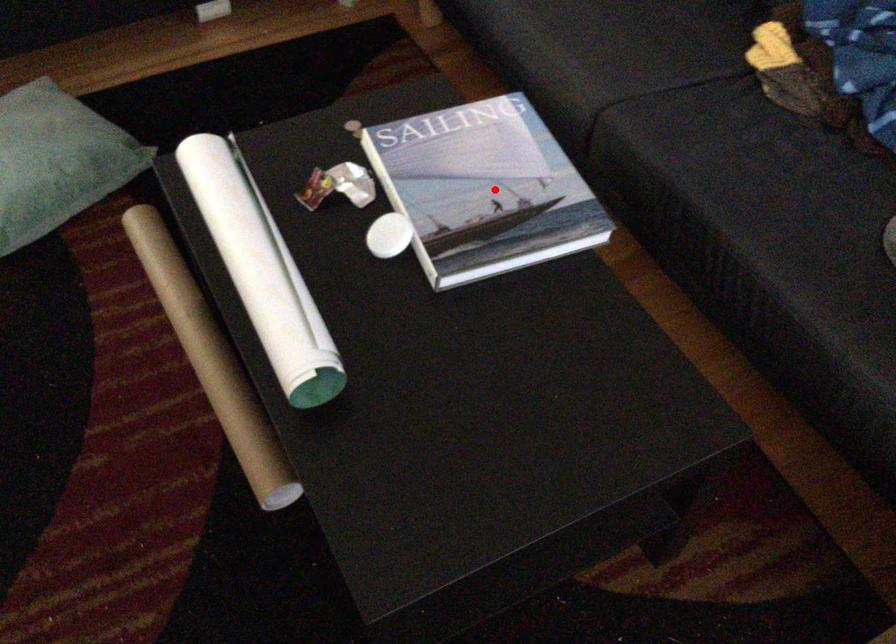
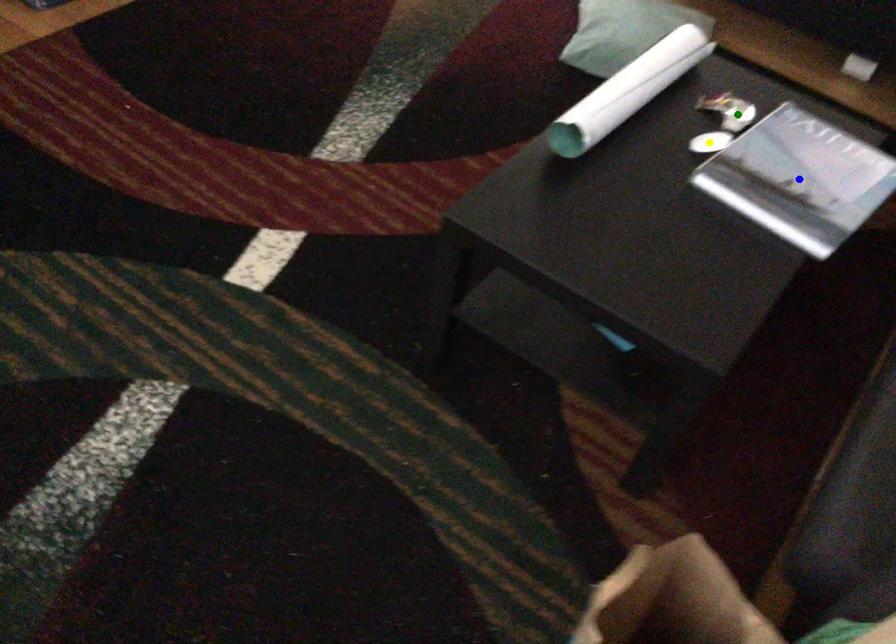
Question: I am providing you with two images of the same scene from different viewpoints. A red point is marked on the first image. You are given multiple points on the second image. Which point in image 2 is actually the same real-world point as the red point in image 1?

Choices:
 (A) yellow point
 (B) blue point
 (C) green point

Answer: (B)